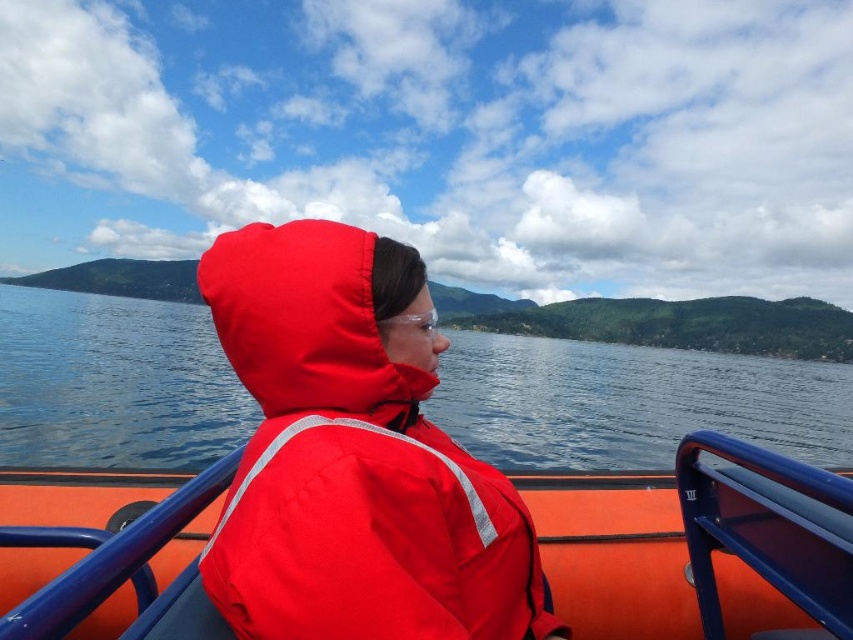
Can you confirm if matte red jacket at center is thinner than matte red life jacket at center?

Incorrect, matte red jacket at center's width is not less than matte red life jacket at center's.

This screenshot has height=640, width=853. Find the location of `matte red jacket at center`. matte red jacket at center is located at coordinates (666, 548).

Does point (766, 628) come farther from viewer compared to point (334, 625)?

That is True.

Image resolution: width=853 pixels, height=640 pixels. I want to click on matte red jacket at center, so click(666, 548).

Is blue water at center to the right of matte red life jacket at center from the viewer's perspective?

Incorrect, blue water at center is not on the right side of matte red life jacket at center.

Between blue water at center and matte red life jacket at center, which one has more height?

With more height is blue water at center.

Who is more forward, (56, 314) or (218, 588)?

Positioned in front is point (218, 588).

I want to click on blue water at center, so click(631, 403).

Is blue water at center above matte red jacket at center?

Correct, blue water at center is located above matte red jacket at center.

Can you confirm if blue water at center is positioned to the right of matte red jacket at center?

Incorrect, blue water at center is not on the right side of matte red jacket at center.

You are a GUI agent. You are given a task and a screenshot of the screen. Output one action in this format:
    pyautogui.click(x=<x>, y=<y>)
    Task: Click on the blue water at center
    
    Given the screenshot: What is the action you would take?
    pyautogui.click(x=631, y=403)

Where is `blue water at center`? The height and width of the screenshot is (640, 853). blue water at center is located at coordinates (631, 403).